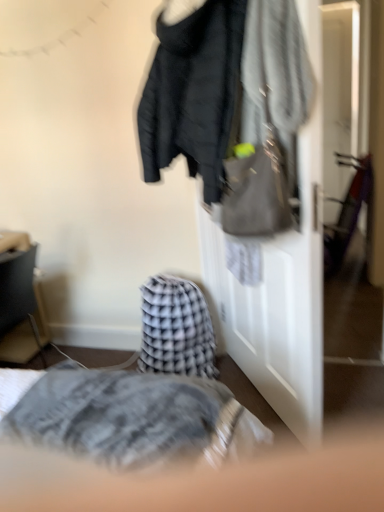
What do you see at coordinates (20, 308) in the screenshot?
I see `matte black side table at left` at bounding box center [20, 308].

Where is `matte black jacket at center`? matte black jacket at center is located at coordinates (248, 181).

I want to click on matte gray handbag at upper right, so click(258, 174).

I want to click on matte black jacket at upper center, so click(193, 93).

In terms of height, does matte gray handbag at upper right look taller or shorter compared to matte black jacket at center?

Considering their sizes, matte gray handbag at upper right has less height than matte black jacket at center.

Is matte gray handbag at upper right wider or thinner than matte black jacket at center?

In the image, matte gray handbag at upper right appears to be wider than matte black jacket at center.

Is matte gray handbag at upper right facing away from matte black jacket at center?

Absolutely, matte gray handbag at upper right is directed away from matte black jacket at center.

From the image's perspective, is matte gray handbag at upper right located above matte black jacket at center?

Indeed, from the image's perspective, matte gray handbag at upper right is shown above matte black jacket at center.

Considering the relative positions of matte black jacket at center and checkered fabric blanket at center in the image provided, is matte black jacket at center in front of checkered fabric blanket at center?

Yes, matte black jacket at center is closer to the camera.

From the image's perspective, relative to checkered fabric blanket at center, is matte black jacket at center above or below?

From the image's perspective, matte black jacket at center appears above checkered fabric blanket at center.

Based on the photo, which point is more forward, (299, 367) or (149, 301)?

The point (299, 367) is closer to the camera.

Which is closer to the camera, (284, 164) or (21, 287)?

Point (284, 164).

In terms of height, does matte gray handbag at upper right look taller or shorter compared to matte black side table at left?

In the image, matte gray handbag at upper right appears to be shorter than matte black side table at left.

Would you say matte gray handbag at upper right is outside matte black side table at left?

That's correct, matte gray handbag at upper right is outside of matte black side table at left.

Which object is further away from the camera taking this photo, matte gray handbag at upper right or matte black side table at left?

matte black side table at left.

From a real-world perspective, is matte black jacket at upper center positioned above or below matte black side table at left?

Clearly, from a real-world perspective, matte black jacket at upper center is above matte black side table at left.

Is matte black jacket at upper center with matte black side table at left?

They are not placed beside each other.

Considering the sizes of matte black jacket at upper center and matte black side table at left in the image, is matte black jacket at upper center taller or shorter than matte black side table at left?

matte black jacket at upper center is shorter than matte black side table at left.

Is matte gray handbag at upper right facing away from matte black jacket at upper center?

Yes, matte gray handbag at upper right's orientation is away from matte black jacket at upper center.

Who is more distant, matte gray handbag at upper right or matte black jacket at upper center?

Positioned behind is matte black jacket at upper center.

Between matte gray handbag at upper right and matte black jacket at upper center, which one has smaller size?

Smaller between the two is matte gray handbag at upper right.

Between point (257, 214) and point (138, 127), which one is positioned behind?

The point (138, 127) is behind.

Based on the photo, is checkered fabric blanket at center far away from matte black side table at left?

No, checkered fabric blanket at center is not far away from matte black side table at left.

From the image's perspective, is checkered fabric blanket at center beneath matte black side table at left?

Yes.

Image resolution: width=384 pixels, height=512 pixels. Find the location of `blanket on the right of matte black side table at left`. blanket on the right of matte black side table at left is located at coordinates (176, 328).

Considering the sizes of checkered fabric blanket at center and matte black jacket at center in the image, is checkered fabric blanket at center bigger or smaller than matte black jacket at center?

In the image, checkered fabric blanket at center appears to be smaller than matte black jacket at center.

Between checkered fabric blanket at center and matte black jacket at center, which one has more height?

matte black jacket at center is taller.

Can we say checkered fabric blanket at center lies outside matte black jacket at center?

Yes, checkered fabric blanket at center is located beyond the bounds of matte black jacket at center.

Would you consider checkered fabric blanket at center to be distant from matte black jacket at center?

Actually, checkered fabric blanket at center and matte black jacket at center are a little close together.

You are a GUI agent. You are given a task and a screenshot of the screen. Output one action in this format:
    pyautogui.click(x=<x>, y=<y>)
    Task: Click on the handbag in front of the matte black jacket at center
    The image size is (384, 512).
    Given the screenshot: What is the action you would take?
    pyautogui.click(x=258, y=174)

This screenshot has width=384, height=512. Identify the location of closet located above the checkered fabric blanket at center (from the image's perspective). (248, 181).

From the image, which object appears to be nearer to matte black jacket at center, matte black jacket at upper center or checkered fabric blanket at center?

Based on the image, matte black jacket at upper center appears to be nearer to matte black jacket at center.

Considering their positions, is matte black jacket at upper center positioned further to matte gray handbag at upper right than matte black jacket at center?

Based on the image, matte black jacket at center appears to be further to matte gray handbag at upper right.

From the image, which object appears to be nearer to checkered fabric blanket at center, matte gray handbag at upper right or matte black jacket at center?

matte black jacket at center is closer to checkered fabric blanket at center.

Looking at the image, which one is located closer to matte black side table at left, matte black jacket at center or matte black jacket at upper center?

matte black jacket at center.

Which object lies further to the anchor point matte black jacket at upper center, checkered fabric blanket at center or matte black side table at left?

The object further to matte black jacket at upper center is matte black side table at left.

Considering their positions, is matte gray handbag at upper right positioned closer to checkered fabric blanket at center than matte black side table at left?

Based on the image, matte black side table at left appears to be nearer to checkered fabric blanket at center.

Based on their spatial positions, is matte black jacket at upper center or matte black side table at left closer to matte black jacket at center?

matte black jacket at upper center lies closer to matte black jacket at center than the other object.

Looking at the image, which one is located further to matte gray handbag at upper right, matte black jacket at center or matte black side table at left?

matte black side table at left.

The width and height of the screenshot is (384, 512). Find the location of `blanket between matte black side table at left and matte black jacket at center`. blanket between matte black side table at left and matte black jacket at center is located at coordinates (x=176, y=328).

Locate an element on the screen. closet between matte gray handbag at upper right and checkered fabric blanket at center from front to back is located at coordinates (248, 181).

The height and width of the screenshot is (512, 384). In order to click on blanket situated between matte black side table at left and matte gray handbag at upper right from left to right in this screenshot , I will do `click(176, 328)`.

Find the location of a particular element. Image resolution: width=384 pixels, height=512 pixels. handbag between matte black jacket at upper center and matte black jacket at center vertically is located at coordinates (258, 174).